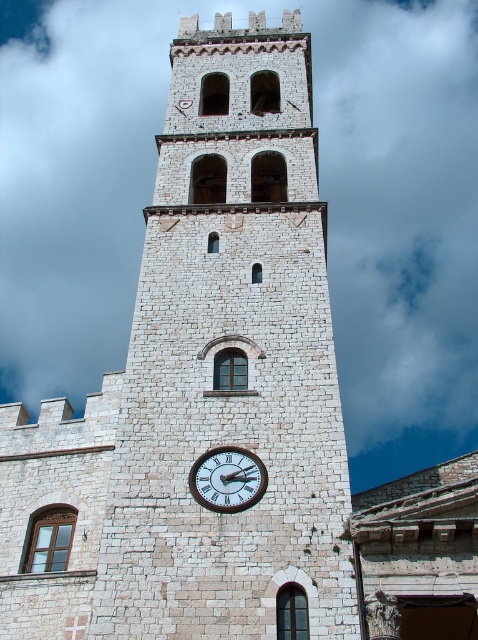
You are an architect designing a new building and want to incorporate a clock feature. The scene shows a white stone clock tower at center and a white wooden clock at center. Which of these two objects would you choose if you want a larger clock feature for better visibility from a distance?

The white stone clock tower at center is larger in size than the white wooden clock at center, so choosing the white stone clock tower at center would provide a larger clock feature for better visibility from a distance.

You are standing at the base of the white stone clock tower at center. Looking up, you notice a point marked at coordinates [230,362]. Where on the tower is this point likely located?

The point [230,362] is located at the center of the white stone clock tower at center, which is where the circular clock face with Roman numerals is situated.

You are standing in front of the tower and want to place a new decorative clock on the wall below the existing clock. Is there enough vertical space between the white stone clock tower at center and the white wooden clock at center to fit a 15 cm tall decoration?

The white stone clock tower at center is above the white wooden clock at center, so there is vertical space between them. However, the description does not provide specific measurements of the distance between the two clocks, so it is uncertain if the 15 cm tall decoration will fit.